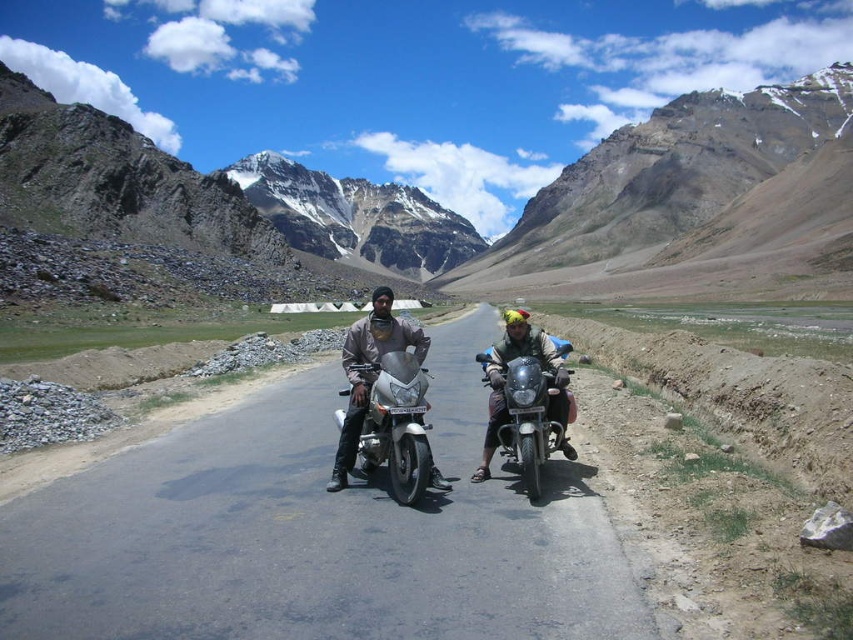
Between rocky gray mountain at center and silver metallic motorcycle at center, which one is positioned higher?

rocky gray mountain at center

Between rocky gray mountain at center and silver metallic motorcycle at center, which one is positioned lower?

silver metallic motorcycle at center is lower down.

Is point (688, 257) farther from camera compared to point (368, 396)?

That is True.

Where is `rocky gray mountain at center`? rocky gray mountain at center is located at coordinates (460, 221).

Which is below, asphalt road at center or rocky gray mountain at center?

asphalt road at center is lower down.

Locate an element on the screen. This screenshot has width=853, height=640. asphalt road at center is located at coordinates (312, 534).

Does rugged stone mountain at upper center have a greater height compared to silver metallic motorcycle at center?

Yes, rugged stone mountain at upper center is taller than silver metallic motorcycle at center.

Is point (798, 262) positioned behind point (412, 365)?

Yes, point (798, 262) is farther from viewer.

Is point (529, 237) more distant than point (347, 394)?

Yes, point (529, 237) is behind point (347, 394).

Where is `rugged stone mountain at upper center`? The width and height of the screenshot is (853, 640). rugged stone mountain at upper center is located at coordinates (693, 205).